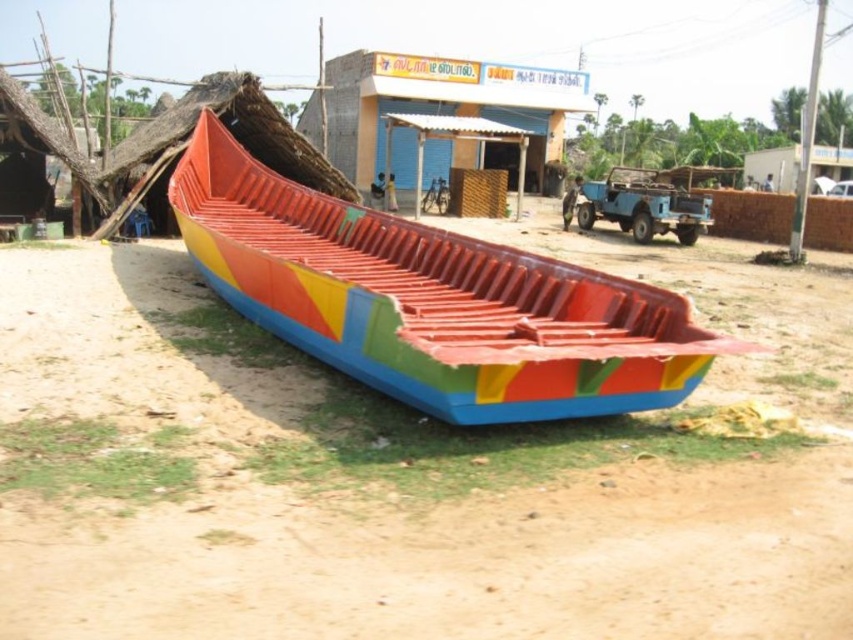
You are a visitor to this village and want to take a photo of both the multicolored plastic boat at center and the matte blue building at center. Which object should you focus on first if you want to capture both in the same frame without moving your camera?

You should focus on the multicolored plastic boat at center first because it is shorter than the matte blue building at center, allowing both to fit within the frame when positioned properly.

You are a visitor in this village and want to take a photo of the matte blue building at center. However, there is a multicolored plastic boat at center blocking your view. Can you move the boat to the right to get a clear shot of the building?

The multicolored plastic boat at center is currently to the left of the matte blue building at center. Moving it to the right would place it further away from the building, allowing you to take a clear photo of the matte blue building at center without obstruction.